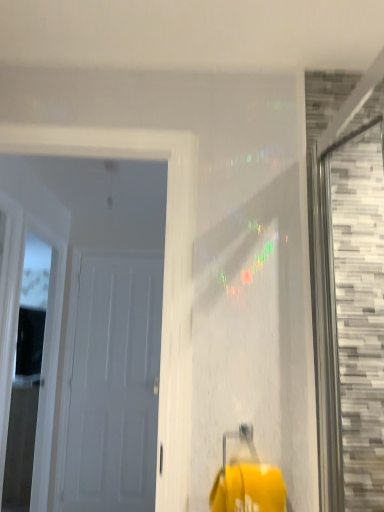
The image size is (384, 512). What are the coordinates of `white wood door at left, the second window positioned from the front` in the screenshot? It's located at (28, 359).

From the picture: In order to face white matte door at left, acting as the 2th door starting from the back, should I rotate leftwards or rightwards?

Turn left by 16.754 degrees to look at white matte door at left, acting as the 2th door starting from the back.

The width and height of the screenshot is (384, 512). What do you see at coordinates (349, 318) in the screenshot?
I see `gray mosaic tile at right, arranged as the first window when viewed from the front` at bounding box center [349, 318].

In order to click on white wood door at left, which is the 1th window in back-to-front order in this screenshot , I will do `click(28, 359)`.

In the scene shown: Is gray mosaic tile at right, which ranks as the second window in back-to-front order, facing away from white matte door at left, the 1th door in the back-to-front sequence?

gray mosaic tile at right, which ranks as the second window in back-to-front order, does not have its back to white matte door at left, the 1th door in the back-to-front sequence.

Which point is more forward, (374, 366) or (122, 338)?

The point (374, 366) is more forward.

Based on the photo, from the image's perspective, would you say gray mosaic tile at right, marked as the first window in a right-to-left arrangement, is positioned over white matte door at left, the 1th door in the back-to-front sequence?

Correct, gray mosaic tile at right, marked as the first window in a right-to-left arrangement, appears higher than white matte door at left, the 1th door in the back-to-front sequence, in the image.

Is gray mosaic tile at right, which ranks as the second window in back-to-front order, taller than white matte door at left, the second door in the front-to-back sequence?

No, gray mosaic tile at right, which ranks as the second window in back-to-front order, is not taller than white matte door at left, the second door in the front-to-back sequence.

Is white wood door at left, placed as the second window when sorted from right to left, far away from white matte door at left, the second door in the front-to-back sequence?

No.

Is white wood door at left, placed as the second window when sorted from right to left, taller or shorter than white matte door at left, the 1th door in the back-to-front sequence?

Considering their sizes, white wood door at left, placed as the second window when sorted from right to left, has more height than white matte door at left, the 1th door in the back-to-front sequence.

Who is more distant, white wood door at left, the second window positioned from the front, or white matte door at left, the 1th door in the back-to-front sequence?

white matte door at left, the 1th door in the back-to-front sequence, is further away from the camera.

From a real-world perspective, is white wood door at left, placed as the second window when sorted from right to left, above or below white matte door at left, the 1th door in the back-to-front sequence?

Clearly, from a real-world perspective, white wood door at left, placed as the second window when sorted from right to left, is above white matte door at left, the 1th door in the back-to-front sequence.

From the image's perspective, which one is positioned higher, white matte door at left, acting as the 2th door starting from the back, or gray mosaic tile at right, arranged as the first window when viewed from the front?

gray mosaic tile at right, arranged as the first window when viewed from the front, from the image's perspective.

Between white matte door at left, the 1th door in the front-to-back sequence, and gray mosaic tile at right, which is counted as the 2th window, starting from the left, which one has smaller width?

white matte door at left, the 1th door in the front-to-back sequence.

Is white matte door at left, the 1th door in the back-to-front sequence, smaller than white matte door at left, the 1th door in the front-to-back sequence?

Indeed, white matte door at left, the 1th door in the back-to-front sequence, has a smaller size compared to white matte door at left, the 1th door in the front-to-back sequence.

Is white matte door at left, the 1th door in the back-to-front sequence, facing towards white matte door at left, acting as the 2th door starting from the back?

Yes.

Is white matte door at left, the second door in the front-to-back sequence, at the right side of white matte door at left, acting as the 2th door starting from the back?

No, white matte door at left, the second door in the front-to-back sequence, is not to the right of white matte door at left, acting as the 2th door starting from the back.

Is white matte door at left, the 1th door in the back-to-front sequence, shorter than white matte door at left, the 1th door in the front-to-back sequence?

No, white matte door at left, the 1th door in the back-to-front sequence, is not shorter than white matte door at left, the 1th door in the front-to-back sequence.

Is white matte door at left, acting as the 2th door starting from the back, facing towards white matte door at left, the second door in the front-to-back sequence?

No, white matte door at left, acting as the 2th door starting from the back, is not aimed at white matte door at left, the second door in the front-to-back sequence.

Can you confirm if white matte door at left, acting as the 2th door starting from the back, is wider than white matte door at left, the second door in the front-to-back sequence?

Yes.

What's the angular difference between white matte door at left, acting as the 2th door starting from the back, and white matte door at left, the 1th door in the back-to-front sequence,'s facing directions?

There is a 0.865-degree angle between the facing directions of white matte door at left, acting as the 2th door starting from the back, and white matte door at left, the 1th door in the back-to-front sequence.

Can we say white matte door at left, the 1th door in the front-to-back sequence, lies outside white matte door at left, the second door in the front-to-back sequence?

That's correct, white matte door at left, the 1th door in the front-to-back sequence, is outside of white matte door at left, the second door in the front-to-back sequence.

Considering the sizes of objects white wood door at left, which is the 1th window in back-to-front order, and gray mosaic tile at right, arranged as the first window when viewed from the front, in the image provided, who is shorter, white wood door at left, which is the 1th window in back-to-front order, or gray mosaic tile at right, arranged as the first window when viewed from the front,?

gray mosaic tile at right, arranged as the first window when viewed from the front, is shorter.

Which is closer, (x=28, y=409) or (x=371, y=360)?

Point (x=371, y=360)

Considering the relative sizes of white wood door at left, placed as the second window when sorted from right to left, and gray mosaic tile at right, which ranks as the second window in back-to-front order, in the image provided, is white wood door at left, placed as the second window when sorted from right to left, wider than gray mosaic tile at right, which ranks as the second window in back-to-front order,?

Yes, white wood door at left, placed as the second window when sorted from right to left, is wider than gray mosaic tile at right, which ranks as the second window in back-to-front order.

Is white wood door at left, placed as the second window when sorted from right to left, directly adjacent to gray mosaic tile at right, marked as the first window in a right-to-left arrangement?

No.

Measure the distance from white matte door at left, the second door in the front-to-back sequence, to gray mosaic tile at right, arranged as the first window when viewed from the front.

7.05 feet.

Is white matte door at left, the 1th door in the back-to-front sequence, with gray mosaic tile at right, arranged as the first window when viewed from the front?

No, white matte door at left, the 1th door in the back-to-front sequence, is not making contact with gray mosaic tile at right, arranged as the first window when viewed from the front.

From the image's perspective, is white matte door at left, the 1th door in the back-to-front sequence, below gray mosaic tile at right, marked as the first window in a right-to-left arrangement?

Yes, from the image's perspective, white matte door at left, the 1th door in the back-to-front sequence, is below gray mosaic tile at right, marked as the first window in a right-to-left arrangement.

Which object is closer to the camera, white matte door at left, the 1th door in the back-to-front sequence, or gray mosaic tile at right, marked as the first window in a right-to-left arrangement?

gray mosaic tile at right, marked as the first window in a right-to-left arrangement, is closer to the camera.

Where is `door that is the 2nd object to the left of the gray mosaic tile at right, which is counted as the 2th window, starting from the left, starting at the anchor`? Image resolution: width=384 pixels, height=512 pixels. door that is the 2nd object to the left of the gray mosaic tile at right, which is counted as the 2th window, starting from the left, starting at the anchor is located at coordinates (115, 384).

Where is `door behind the white wood door at left, placed as the second window when sorted from right to left`? The height and width of the screenshot is (512, 384). door behind the white wood door at left, placed as the second window when sorted from right to left is located at coordinates (115, 384).

Consider the image. Estimate the real-world distances between objects in this image. Which object is further from white wood door at left, the first window positioned from the left, gray mosaic tile at right, arranged as the first window when viewed from the front, or white matte door at left, the 1th door in the front-to-back sequence?

Based on the image, gray mosaic tile at right, arranged as the first window when viewed from the front, appears to be further to white wood door at left, the first window positioned from the left.

Estimate the real-world distances between objects in this image. Which object is further from gray mosaic tile at right, which is counted as the 2th window, starting from the left, white matte door at left, the 1th door in the back-to-front sequence, or white wood door at left, the first window positioned from the left?

Among the two, white matte door at left, the 1th door in the back-to-front sequence, is located further to gray mosaic tile at right, which is counted as the 2th window, starting from the left.

Which object lies nearer to the anchor point white matte door at left, the second door in the front-to-back sequence, gray mosaic tile at right, marked as the first window in a right-to-left arrangement, or white matte door at left, the 1th door in the front-to-back sequence?

white matte door at left, the 1th door in the front-to-back sequence.

Considering their positions, is gray mosaic tile at right, marked as the first window in a right-to-left arrangement, positioned closer to white matte door at left, the second door in the front-to-back sequence, than white wood door at left, the first window positioned from the left?

Based on the image, white wood door at left, the first window positioned from the left, appears to be nearer to white matte door at left, the second door in the front-to-back sequence.

Looking at the image, which one is located further to gray mosaic tile at right, arranged as the first window when viewed from the front, white wood door at left, which is the 1th window in back-to-front order, or white matte door at left, the 1th door in the front-to-back sequence?

white wood door at left, which is the 1th window in back-to-front order.

Estimate the real-world distances between objects in this image. Which object is further from white matte door at left, acting as the 2th door starting from the back, white matte door at left, the 1th door in the back-to-front sequence, or white wood door at left, placed as the second window when sorted from right to left?

The object further to white matte door at left, acting as the 2th door starting from the back, is white matte door at left, the 1th door in the back-to-front sequence.

Based on their spatial positions, is gray mosaic tile at right, which ranks as the second window in back-to-front order, or white wood door at left, placed as the second window when sorted from right to left, further from white matte door at left, the 1th door in the front-to-back sequence?

Based on the image, white wood door at left, placed as the second window when sorted from right to left, appears to be further to white matte door at left, the 1th door in the front-to-back sequence.

In the scene shown: Which object lies nearer to the anchor point gray mosaic tile at right, which ranks as the second window in back-to-front order, white matte door at left, the 1th door in the front-to-back sequence, or white matte door at left, the 1th door in the back-to-front sequence?

white matte door at left, the 1th door in the front-to-back sequence, is positioned closer to the anchor gray mosaic tile at right, which ranks as the second window in back-to-front order.

Where is `window between white matte door at left, acting as the 2th door starting from the back, and white matte door at left, the second door in the front-to-back sequence, along the z-axis`? Image resolution: width=384 pixels, height=512 pixels. window between white matte door at left, acting as the 2th door starting from the back, and white matte door at left, the second door in the front-to-back sequence, along the z-axis is located at coordinates (28, 359).

Where is `window between gray mosaic tile at right, which is counted as the 2th window, starting from the left, and white matte door at left, the second door in the front-to-back sequence, along the z-axis`? window between gray mosaic tile at right, which is counted as the 2th window, starting from the left, and white matte door at left, the second door in the front-to-back sequence, along the z-axis is located at coordinates (28, 359).

The image size is (384, 512). What are the coordinates of `door between gray mosaic tile at right, which is counted as the 2th window, starting from the left, and white matte door at left, the 1th door in the back-to-front sequence, in the front-back direction` in the screenshot? It's located at pos(164,272).